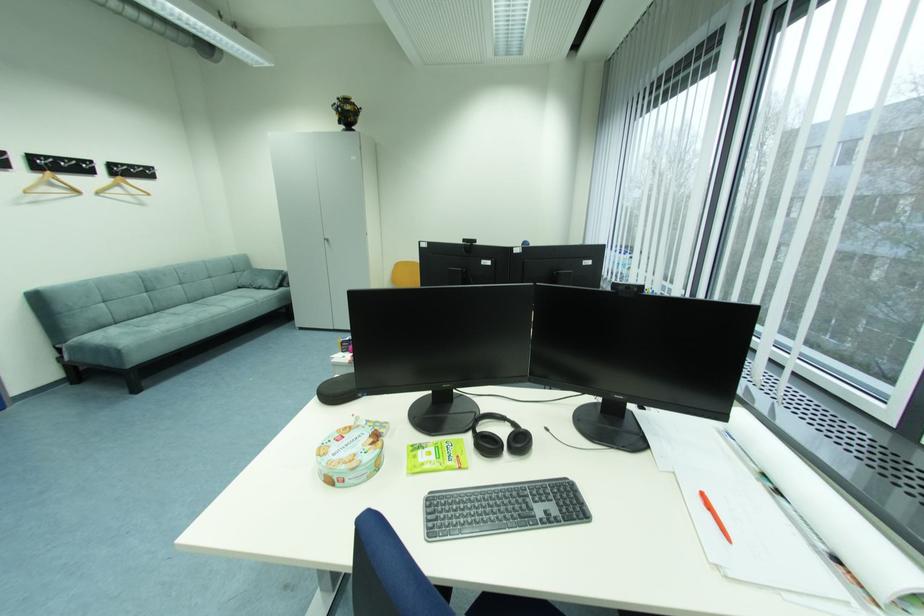
Find where to resting arm the sofa armrest. Please return your answer as a coordinate pair (x, y).

(259, 278)